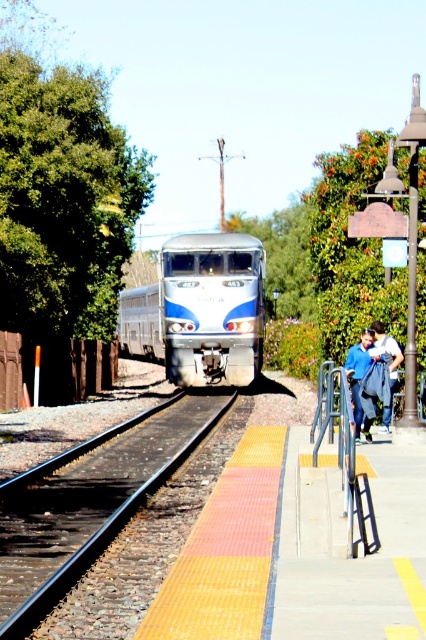
Question: Is metallic gray rail at lower center bigger than black metal track at center?

Choices:
 (A) yes
 (B) no

Answer: (A)

Question: Is blue fabric jacket at right behind denim jacket at right?

Choices:
 (A) yes
 (B) no

Answer: (B)

Question: Which of these objects is positioned closest to the silver metallic train at center?

Choices:
 (A) denim jacket at right
 (B) blue fabric jacket at right
 (C) metallic gray rail at lower center

Answer: (A)

Question: Does black metal track at center have a lesser width compared to blue fabric jacket at right?

Choices:
 (A) no
 (B) yes

Answer: (A)

Question: Estimate the real-world distances between objects in this image. Which object is closer to the metallic gray rail at lower center?

Choices:
 (A) denim jacket at right
 (B) blue fabric jacket at right

Answer: (B)

Question: Which of the following is the farthest from the observer?

Choices:
 (A) metallic gray rail at lower center
 (B) blue fabric jacket at right
 (C) silver metallic train at center
 (D) black metal track at center

Answer: (C)